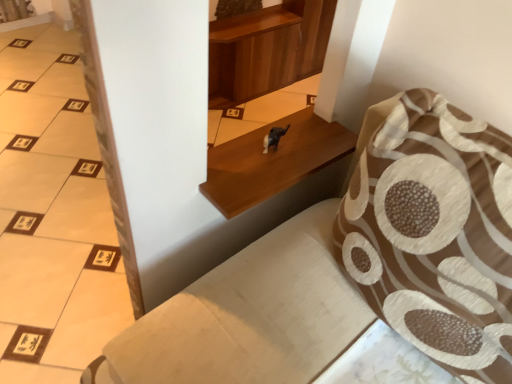
Question: From the image's perspective, is wooden shelf at center positioned above or below brown textured pillow at upper right?

Choices:
 (A) below
 (B) above

Answer: (B)

Question: In the image, is wooden shelf at center on the left side or the right side of brown textured pillow at upper right?

Choices:
 (A) left
 (B) right

Answer: (A)

Question: Which object is positioned closest to the wooden shelf at center?

Choices:
 (A) brown textured pillow at upper right
 (B) shiny black dog at center

Answer: (B)

Question: Which object is positioned farthest from the wooden shelf at center?

Choices:
 (A) shiny black dog at center
 (B) brown textured pillow at upper right

Answer: (B)